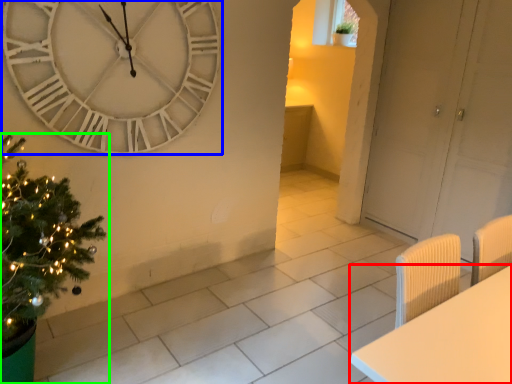
Question: Which is nearer to the furniture (highlighted by a red box)? wall clock (highlighted by a blue box) or christmas tree (highlighted by a green box).

Choices:
 (A) wall clock
 (B) christmas tree

Answer: (B)